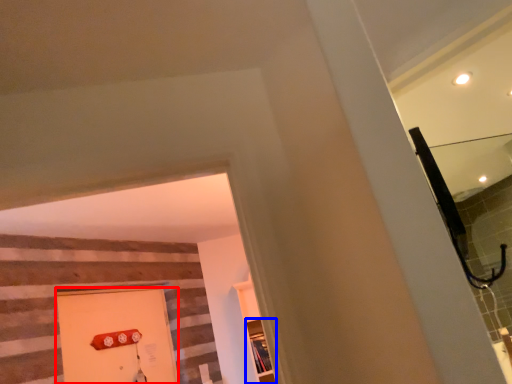
Question: Which point is further to the camera, door (highlighted by a red box) or shelf (highlighted by a blue box)?

Choices:
 (A) door
 (B) shelf

Answer: (B)